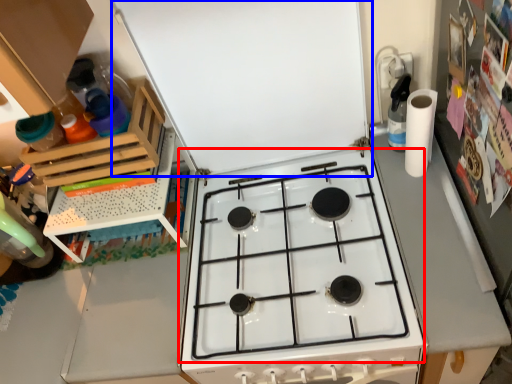
Question: Which of the following is the closest to the observer, gas stove (highlighted by a red box) or exhaust hood (highlighted by a blue box)?

Choices:
 (A) gas stove
 (B) exhaust hood

Answer: (B)